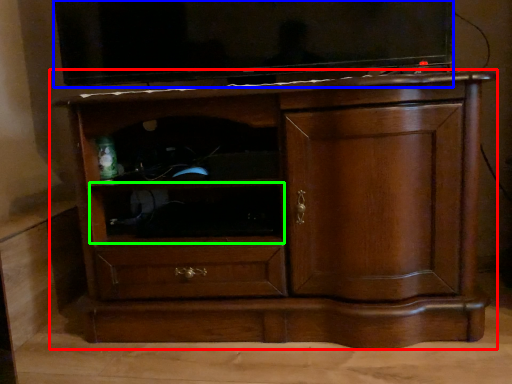
Question: Considering the real-world distances, which object is closest to chest of drawers (highlighted by a red box)? television (highlighted by a blue box) or shelf (highlighted by a green box).

Choices:
 (A) television
 (B) shelf

Answer: (B)